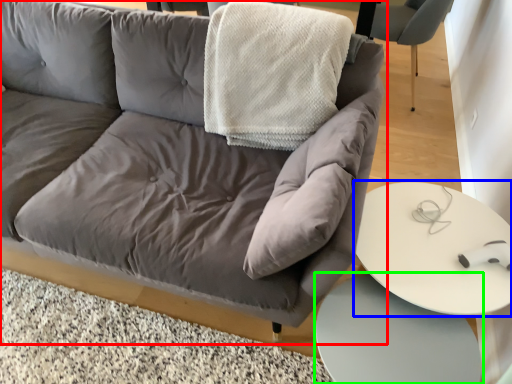
Question: Considering the real-world distances, which object is closest to studio couch (highlighted by a red box)? table (highlighted by a blue box) or table (highlighted by a green box).

Choices:
 (A) table
 (B) table

Answer: (A)